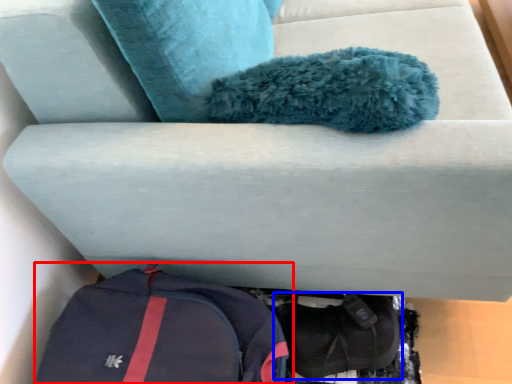
Question: Which point is further to the camera, backpack (highlighted by a red box) or shoe (highlighted by a blue box)?

Choices:
 (A) backpack
 (B) shoe

Answer: (B)